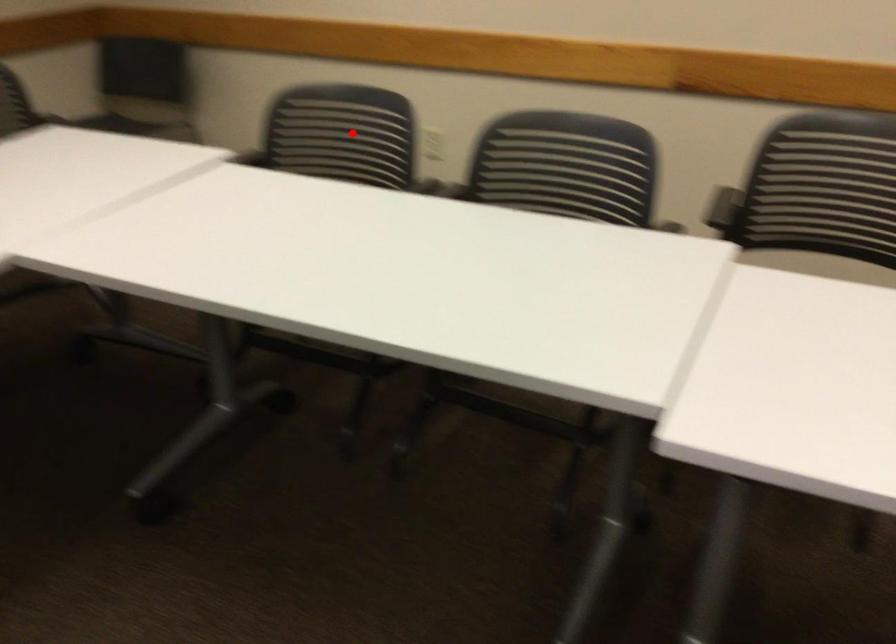
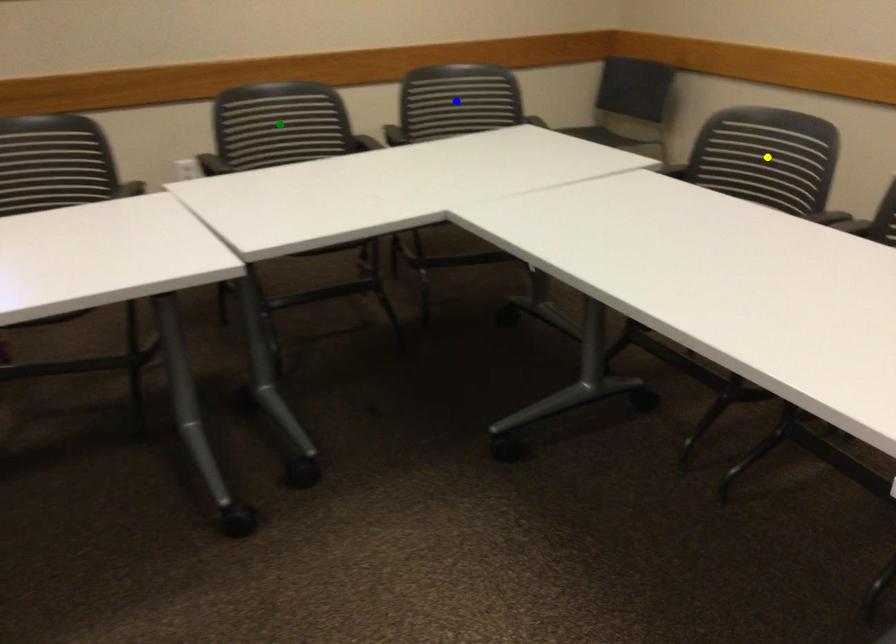
Question: I am providing you with two images of the same scene from different viewpoints. A red point is marked on the first image. You are given multiple points on the second image. Can you choose the point in image 2 that corresponds to the point in image 1?

Choices:
 (A) blue point
 (B) green point
 (C) yellow point

Answer: (C)